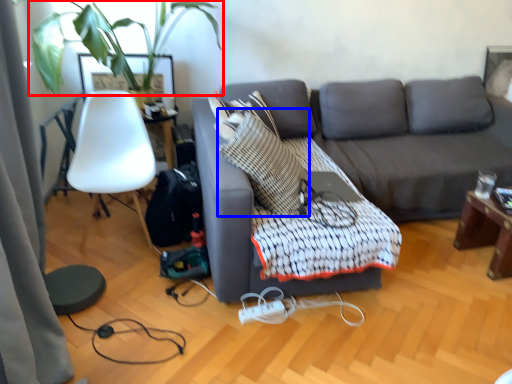
Question: Which point is closer to the camera, plant (highlighted by a red box) or throw pillow (highlighted by a blue box)?

Choices:
 (A) plant
 (B) throw pillow

Answer: (A)